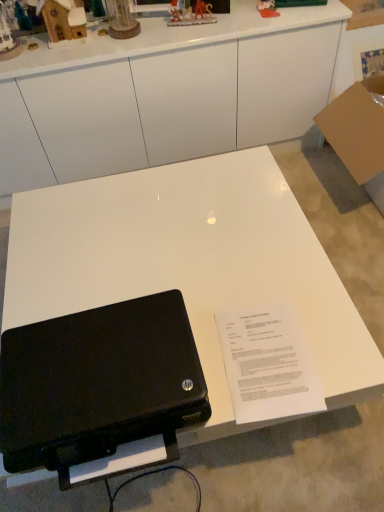
The width and height of the screenshot is (384, 512). What are the coordinates of `vacant area that is situated to the right of metallic silver sleigh at upper center, placed as the second toy when sorted from right to left` in the screenshot? It's located at (219, 16).